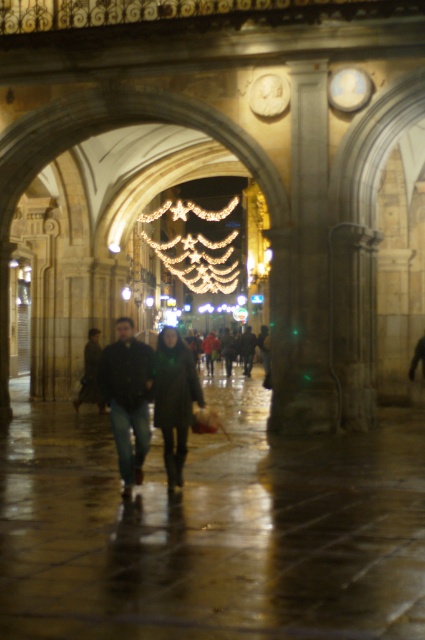
Question: Which point is closer to the camera?

Choices:
 (A) (118, 401)
 (B) (110, 408)
 (C) (90, 374)

Answer: (A)

Question: In this image, where is dark blue jeans at center located relative to dark gray coat at center?

Choices:
 (A) above
 (B) below

Answer: (A)

Question: Is dark green leather jacket at center bigger than black matte coat at center?

Choices:
 (A) yes
 (B) no

Answer: (A)

Question: Is dark green leather jacket at center thinner than dark blue jeans at center?

Choices:
 (A) no
 (B) yes

Answer: (A)

Question: Which point is closer to the camera?

Choices:
 (A) dark green leather jacket at center
 (B) dark blue jeans at center
 (C) black matte coat at center
 (D) dark gray coat at center

Answer: (C)

Question: Estimate the real-world distances between objects in this image. Which object is farther from the dark blue jeans at center?

Choices:
 (A) dark gray coat at center
 (B) black matte coat at center
 (C) dark green leather jacket at center

Answer: (A)